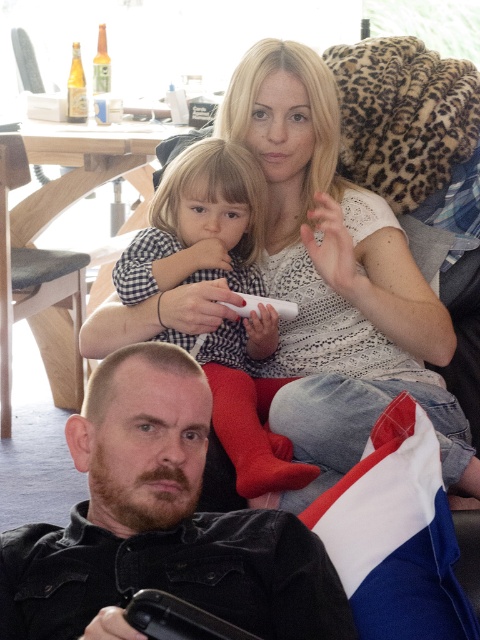
This screenshot has width=480, height=640. Find the location of `white lace shirt at upper center`. white lace shirt at upper center is located at coordinates (337, 275).

Does white lace shirt at upper center come behind dark brown leather jacket at lower left?

Yes, it is behind dark brown leather jacket at lower left.

Where is `white lace shirt at upper center`? white lace shirt at upper center is located at coordinates (337, 275).

Can you confirm if white lace shirt at upper center is taller than white plastic remote at center?

Yes.

Who is positioned more to the left, white lace shirt at upper center or white plastic remote at center?

From the viewer's perspective, white plastic remote at center appears more on the left side.

Image resolution: width=480 pixels, height=640 pixels. Describe the element at coordinates (337, 275) in the screenshot. I see `white lace shirt at upper center` at that location.

Identify the location of white lace shirt at upper center. (337, 275).

The image size is (480, 640). What do you see at coordinates (199, 225) in the screenshot?
I see `checkered fabric shirt at upper center` at bounding box center [199, 225].

Does checkered fabric shirt at upper center appear on the right side of white plastic remote at center?

In fact, checkered fabric shirt at upper center is to the left of white plastic remote at center.

Which is behind, point (245, 438) or point (245, 310)?

Point (245, 310)

This screenshot has height=640, width=480. Find the location of `checkered fabric shirt at upper center`. checkered fabric shirt at upper center is located at coordinates click(199, 225).